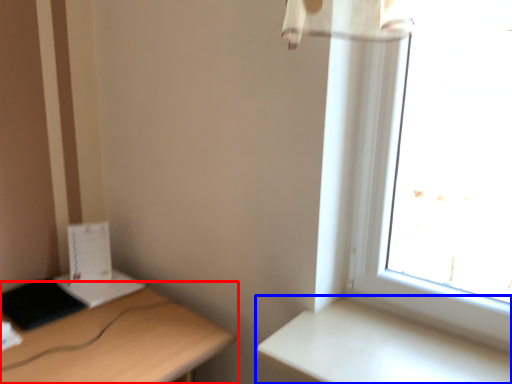
Question: Which object appears closest to the camera in this image, desk (highlighted by a red box) or table (highlighted by a blue box)?

Choices:
 (A) desk
 (B) table

Answer: (A)